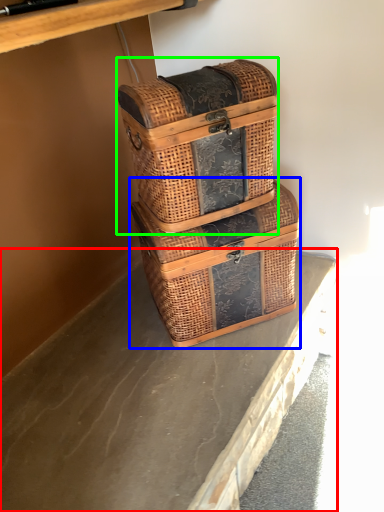
Question: Which object is the farthest from concrete (highlighted by a red box)? Choose among these: picnic basket (highlighted by a blue box) or picnic basket (highlighted by a green box).

Choices:
 (A) picnic basket
 (B) picnic basket

Answer: (B)